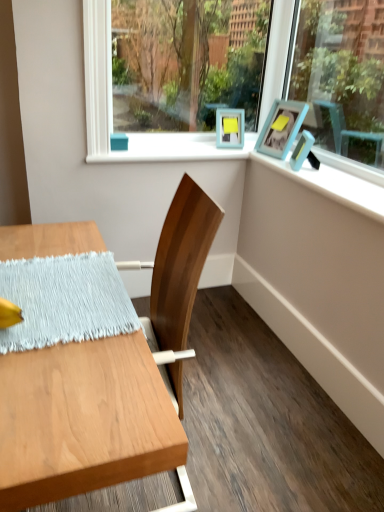
Question: Is matte blue picture frame at upper right, arranged as the first picture frame when viewed from the front, closer to the viewer compared to blue painted wood at upper right?

Choices:
 (A) yes
 (B) no

Answer: (B)

Question: Considering the relative sizes of matte blue picture frame at upper right, arranged as the first picture frame when viewed from the front, and blue painted wood at upper right in the image provided, is matte blue picture frame at upper right, arranged as the first picture frame when viewed from the front, smaller than blue painted wood at upper right?

Choices:
 (A) no
 (B) yes

Answer: (B)

Question: From a real-world perspective, is matte blue picture frame at upper right, arranged as the first picture frame when viewed from the front, located beneath blue painted wood at upper right?

Choices:
 (A) no
 (B) yes

Answer: (A)

Question: From a real-world perspective, is matte blue picture frame at upper right, which is the second picture frame from back to front, positioned over blue painted wood at upper right based on gravity?

Choices:
 (A) yes
 (B) no

Answer: (A)

Question: Can you confirm if matte blue picture frame at upper right, which is the second picture frame from back to front, is thinner than blue painted wood at upper right?

Choices:
 (A) yes
 (B) no

Answer: (A)

Question: Is light blue woven placemat at left bigger or smaller than matte blue picture frame at upper right, which is the second picture frame from back to front?

Choices:
 (A) small
 (B) big

Answer: (A)

Question: From a real-world perspective, relative to matte blue picture frame at upper right, which is the second picture frame from back to front, is light blue woven placemat at left vertically above or below?

Choices:
 (A) below
 (B) above

Answer: (A)

Question: Relative to matte blue picture frame at upper right, which is the second picture frame from back to front, is light blue woven placemat at left in front or behind?

Choices:
 (A) front
 (B) behind

Answer: (A)

Question: Considering the positions of light blue woven placemat at left and matte blue picture frame at upper right, arranged as the first picture frame when viewed from the front, in the image, is light blue woven placemat at left taller or shorter than matte blue picture frame at upper right, arranged as the first picture frame when viewed from the front,?

Choices:
 (A) tall
 (B) short

Answer: (B)

Question: Choose the correct answer: Is light blue woven placemat at left inside blue painted wood at upper right or outside it?

Choices:
 (A) inside
 (B) outside

Answer: (B)

Question: In the image, is light blue woven placemat at left on the left side or the right side of blue painted wood at upper right?

Choices:
 (A) left
 (B) right

Answer: (A)

Question: Looking at their shapes, would you say light blue woven placemat at left is wider or thinner than blue painted wood at upper right?

Choices:
 (A) wide
 (B) thin

Answer: (A)

Question: Is point (52, 320) positioned closer to the camera than point (283, 165)?

Choices:
 (A) closer
 (B) farther

Answer: (A)

Question: Is blue painted wood at upper right to the left or to the right of clear glass window screen at upper center in the image?

Choices:
 (A) right
 (B) left

Answer: (A)

Question: Looking at the image, does blue painted wood at upper right seem bigger or smaller compared to clear glass window screen at upper center?

Choices:
 (A) big
 (B) small

Answer: (B)